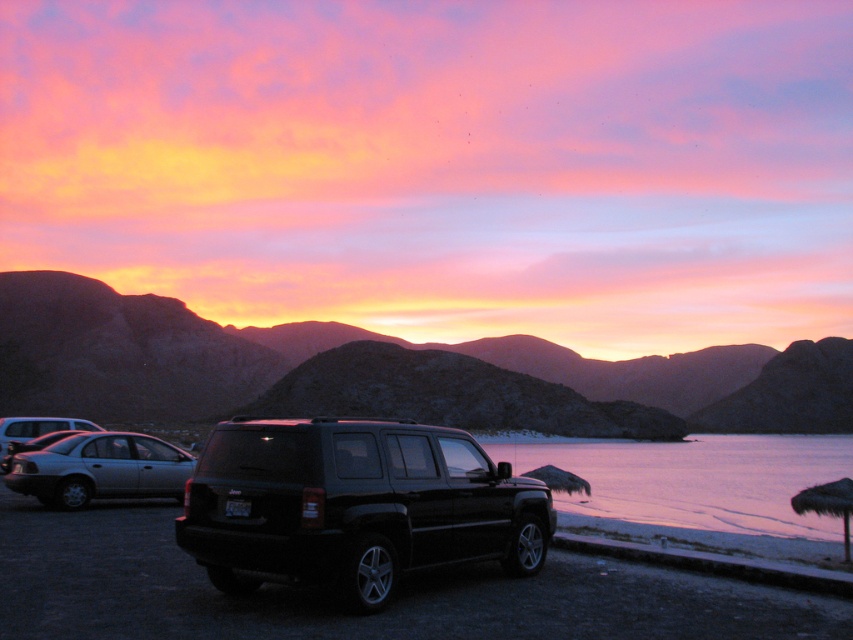
You are a photographer planning to capture the sunset with both the black glossy suv at center and the pink smooth water at lower right in the frame. Based on their heights, which object should you position closer to the camera to ensure both are fully visible in the photo?

Since the black glossy suv at center is shorter than the pink smooth water at lower right, you should position the black glossy suv at center closer to the camera to ensure its full height is captured in the photo while still including the pink smooth water at lower right in the background.

You are planning to take a photo of the black glossy suv at center and the silhouetted rock formation at center. Which object is wider in the scene?

The silhouetted rock formation at center is wider than the black glossy suv at center.

You are planning to take a photo of the sunset with both the silhouetted rock formation at center and the black glossy suv at center in the frame. Based on their sizes, which object should you focus on to ensure both fit in the photo?

The silhouetted rock formation at center is bigger than the black glossy suv at center, so you should focus on the larger object, the silhouetted rock formation at center, to ensure both fit in the photo.